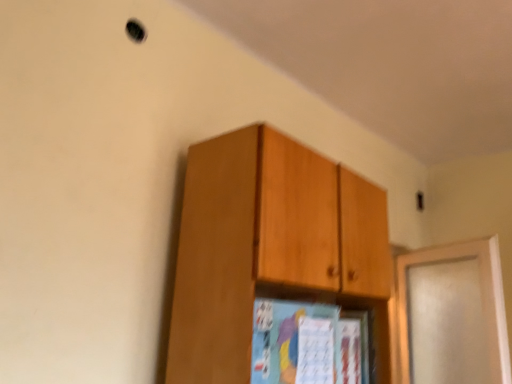
You are a GUI agent. You are given a task and a screenshot of the screen. Output one action in this format:
    pyautogui.click(x=<x>, y=<y>)
    Task: Click on the satin white door at right
    
    Given the screenshot: What is the action you would take?
    pyautogui.click(x=453, y=315)

The height and width of the screenshot is (384, 512). Describe the element at coordinates (453, 315) in the screenshot. I see `satin white door at right` at that location.

In order to face satin white door at right, should I rotate leftwards or rightwards?

Turn right approximately 24.603 degrees to face it.

Describe the element at coordinates (272, 249) in the screenshot. I see `wooden cabinet at upper center` at that location.

I want to click on wooden cabinet at upper center, so click(x=272, y=249).

Identify the location of satin white door at right. (453, 315).

Considering the positions of objects wooden cabinet at upper center and satin white door at right in the image provided, who is more to the left, wooden cabinet at upper center or satin white door at right?

wooden cabinet at upper center is more to the left.

Considering the relative positions of wooden cabinet at upper center and satin white door at right in the image provided, is wooden cabinet at upper center in front of satin white door at right?

Yes.

Between point (201, 173) and point (472, 360), which one is positioned behind?

The point (472, 360) is behind.

From the image's perspective, is wooden cabinet at upper center located above or below satin white door at right?

wooden cabinet at upper center is situated higher than satin white door at right in the image.

From a real-world perspective, does wooden cabinet at upper center sit lower than satin white door at right?

Incorrect, from a real-world perspective, wooden cabinet at upper center is higher than satin white door at right.

Considering the sizes of objects wooden cabinet at upper center and satin white door at right in the image provided, who is wider, wooden cabinet at upper center or satin white door at right?

wooden cabinet at upper center is wider.

Considering the sizes of objects wooden cabinet at upper center and satin white door at right in the image provided, who is taller, wooden cabinet at upper center or satin white door at right?

wooden cabinet at upper center is taller.

Is wooden cabinet at upper center bigger or smaller than satin white door at right?

Clearly, wooden cabinet at upper center is larger in size than satin white door at right.

Would you say wooden cabinet at upper center contains satin white door at right?

No, satin white door at right is not surrounded by wooden cabinet at upper center.

Would you consider wooden cabinet at upper center to be distant from satin white door at right?

Yes, wooden cabinet at upper center is far from satin white door at right.

In the scene shown: Does wooden cabinet at upper center turn towards satin white door at right?

No, wooden cabinet at upper center is not aimed at satin white door at right.

Image resolution: width=512 pixels, height=384 pixels. Identify the location of door behind the wooden cabinet at upper center. (453, 315).

Looking at this image, which object is positioned more to the left, satin white door at right or wooden cabinet at upper center?

wooden cabinet at upper center is more to the left.

Which object is further away from the camera, satin white door at right or wooden cabinet at upper center?

Positioned behind is satin white door at right.

Which point is more forward, (492, 373) or (265, 278)?

The point (265, 278) is closer.

Based on the photo, from the image's perspective, does satin white door at right appear lower than wooden cabinet at upper center?

Indeed, from the image's perspective, satin white door at right is shown beneath wooden cabinet at upper center.

From a real-world perspective, which object stands above the other?

wooden cabinet at upper center is physically above.

Can you confirm if satin white door at right is thinner than wooden cabinet at upper center?

Yes, satin white door at right is thinner than wooden cabinet at upper center.

In terms of height, does satin white door at right look taller or shorter compared to wooden cabinet at upper center?

satin white door at right is shorter than wooden cabinet at upper center.

Which of these two, satin white door at right or wooden cabinet at upper center, is smaller?

satin white door at right is smaller.

Is wooden cabinet at upper center surrounded by satin white door at right?

No, wooden cabinet at upper center is located outside of satin white door at right.

Is satin white door at right placed right next to wooden cabinet at upper center?

satin white door at right is not next to wooden cabinet at upper center, and they're not touching.

Is satin white door at right oriented away from wooden cabinet at upper center?

No.

How far apart are satin white door at right and wooden cabinet at upper center?

satin white door at right is 3.92 feet away from wooden cabinet at upper center.

In order to click on cabinetry lying on the left of satin white door at right in this screenshot , I will do `click(272, 249)`.

The height and width of the screenshot is (384, 512). I want to click on door directly beneath the wooden cabinet at upper center (from a real-world perspective), so click(x=453, y=315).

This screenshot has width=512, height=384. Find the location of `cabinetry that appears above the satin white door at right (from the image's perspective)`. cabinetry that appears above the satin white door at right (from the image's perspective) is located at coordinates (272, 249).